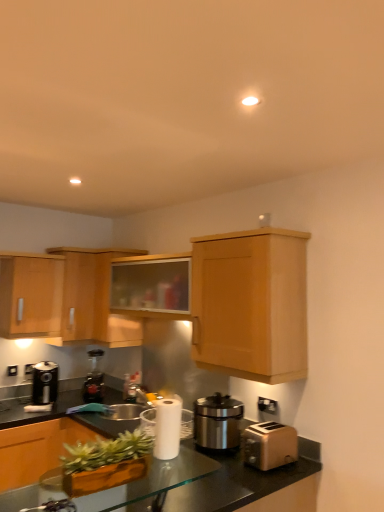
Question: Is satin silver sink at center oriented towards black metallic coffee machine at left, marked as the second coffee machine in a back-to-front arrangement?

Choices:
 (A) yes
 (B) no

Answer: (B)

Question: Is black metallic coffee machine at left, marked as the second coffee machine in a back-to-front arrangement, surrounded by satin silver sink at center?

Choices:
 (A) no
 (B) yes

Answer: (A)

Question: Is satin silver sink at center at the right side of black metallic coffee machine at left, marked as the second coffee machine in a back-to-front arrangement?

Choices:
 (A) no
 (B) yes

Answer: (B)

Question: From a real-world perspective, is satin silver sink at center physically below black metallic coffee machine at left, marked as the second coffee machine in a back-to-front arrangement?

Choices:
 (A) yes
 (B) no

Answer: (A)

Question: Considering the relative sizes of satin silver sink at center and black metallic coffee machine at left, which is the 1th coffee machine in front-to-back order, in the image provided, is satin silver sink at center thinner than black metallic coffee machine at left, which is the 1th coffee machine in front-to-back order,?

Choices:
 (A) yes
 (B) no

Answer: (B)

Question: Looking at the image, does wooden cabinet at upper center, which ranks as the second cabinetry in right-to-left order, seem bigger or smaller compared to satin silver appliance at center?

Choices:
 (A) small
 (B) big

Answer: (B)

Question: Do you think wooden cabinet at upper center, which ranks as the second cabinetry in right-to-left order, is within satin silver appliance at center, or outside of it?

Choices:
 (A) inside
 (B) outside

Answer: (B)

Question: Relative to satin silver appliance at center, is wooden cabinet at upper center, which ranks as the 4th cabinetry in left-to-right order, in front or behind?

Choices:
 (A) behind
 (B) front

Answer: (A)

Question: From a real-world perspective, is wooden cabinet at upper center, which ranks as the second cabinetry in right-to-left order, positioned above or below satin silver appliance at center?

Choices:
 (A) above
 (B) below

Answer: (A)

Question: Would you say brown matte toaster at lower right is inside or outside black plastic toaster at lower right?

Choices:
 (A) inside
 (B) outside

Answer: (B)

Question: Considering the positions of brown matte toaster at lower right and black plastic toaster at lower right in the image, is brown matte toaster at lower right taller or shorter than black plastic toaster at lower right?

Choices:
 (A) short
 (B) tall

Answer: (B)

Question: Based on their sizes in the image, would you say brown matte toaster at lower right is bigger or smaller than black plastic toaster at lower right?

Choices:
 (A) small
 (B) big

Answer: (B)

Question: Is brown matte toaster at lower right wider or thinner than black plastic toaster at lower right?

Choices:
 (A) wide
 (B) thin

Answer: (A)

Question: Does point (223, 347) appear closer or farther from the camera than point (97, 392)?

Choices:
 (A) closer
 (B) farther

Answer: (A)

Question: Is wooden cabinet at upper right, the 5th cabinetry viewed from the left, taller or shorter than metallic black coffee machine at lower left, which is the 1th coffee machine from back to front?

Choices:
 (A) short
 (B) tall

Answer: (B)